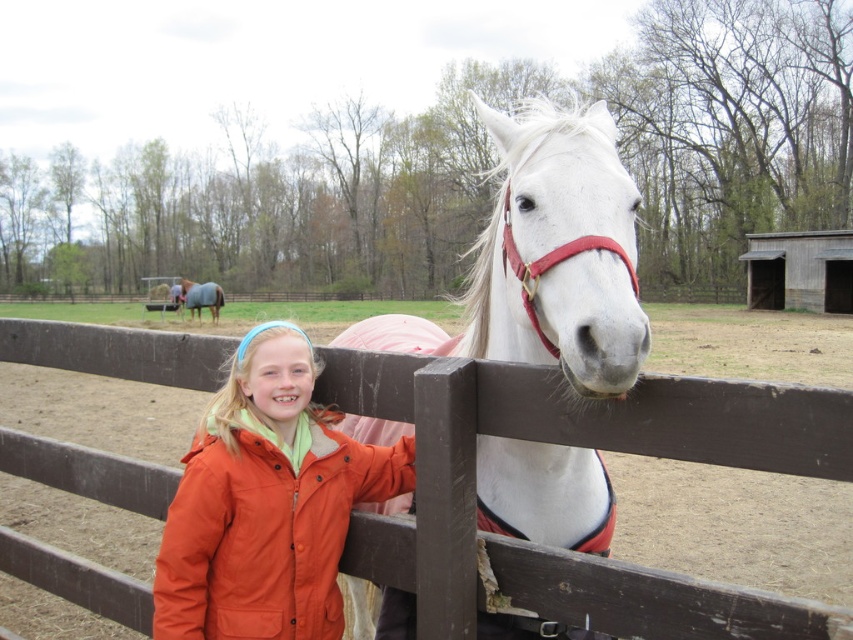
Is brown wooden fence at center positioned in front of gray felt blanket at upper left?

Yes.

Locate an element on the screen. brown wooden fence at center is located at coordinates (553, 442).

Does white glossy horse at center appear over orange matte jacket at lower left?

Yes.

Who is positioned more to the right, white glossy horse at center or orange matte jacket at lower left?

white glossy horse at center

Describe the element at coordinates (544, 257) in the screenshot. The width and height of the screenshot is (853, 640). I see `white glossy horse at center` at that location.

Locate an element on the screen. white glossy horse at center is located at coordinates (544, 257).

Between brown wooden fence at center and orange matte jacket at lower left, which one appears on the left side from the viewer's perspective?

orange matte jacket at lower left is more to the left.

Does brown wooden fence at center come in front of orange matte jacket at lower left?

Yes.

The width and height of the screenshot is (853, 640). I want to click on brown wooden fence at center, so click(x=553, y=442).